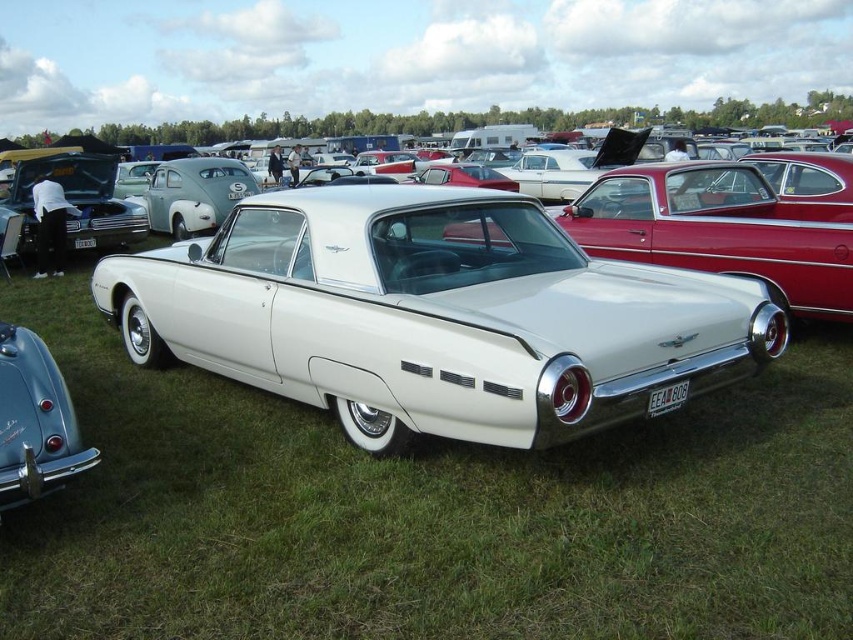
You are standing at the center of the grassy field where the classic car exhibition is held. You see a point marked at coordinates (434, 316). What object does this point correspond to?

The point at coordinates (434, 316) corresponds to the white glossy car at center.

You are a photographer positioned at the edge of the field. You want to capture a photo that includes both the white glossy car at center and the shiny chrome bumper at lower left. Based on their positions, which object should you pan your camera towards first to ensure both are in frame?

Since the white glossy car at center is to the right of the shiny chrome bumper at lower left, you should pan your camera towards the shiny chrome bumper at lower left first to include both in the frame.